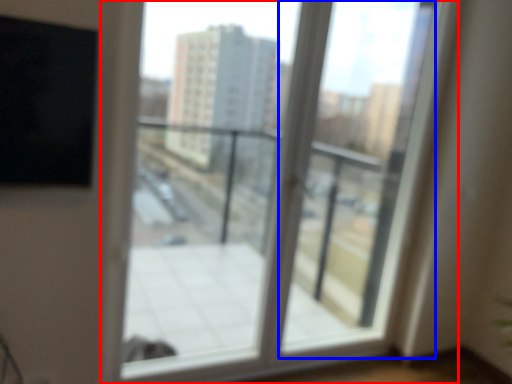
Question: Which of the following is the farthest to the observer, window (highlighted by a red box) or screen door (highlighted by a blue box)?

Choices:
 (A) window
 (B) screen door

Answer: (B)